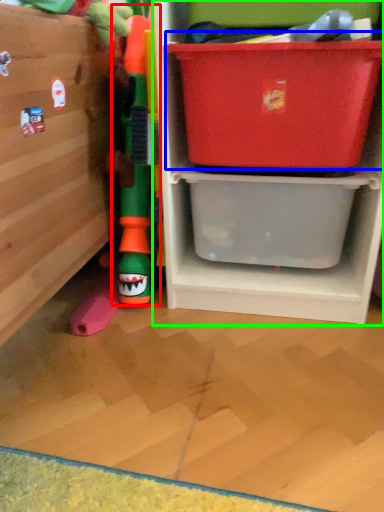
Question: Estimate the real-world distances between objects in this image. Which object is closer to toy (highlighted by a red box), storage box (highlighted by a blue box) or shelf (highlighted by a green box)?

Choices:
 (A) storage box
 (B) shelf

Answer: (B)